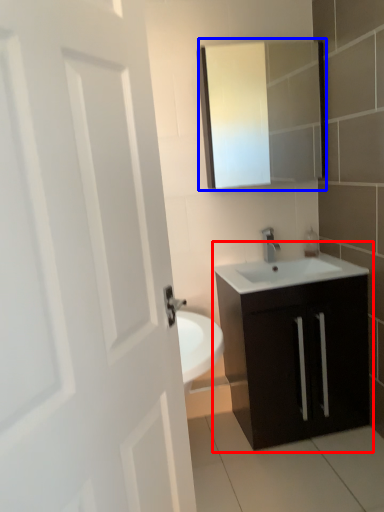
Question: Which object appears closest to the camera in this image, bathroom cabinet (highlighted by a red box) or medicine cabinet (highlighted by a blue box)?

Choices:
 (A) bathroom cabinet
 (B) medicine cabinet

Answer: (A)